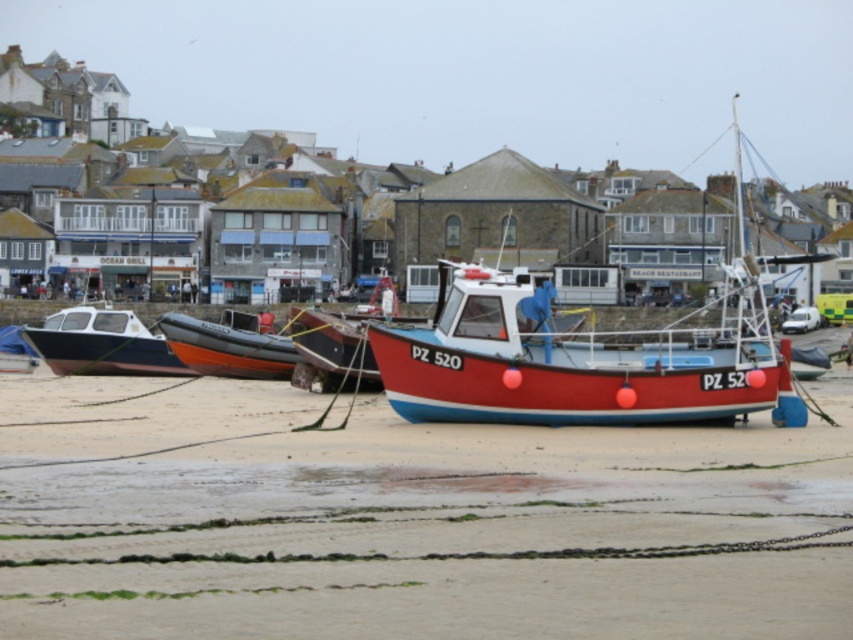
You are standing on the beach and want to walk from the smooth sand at lower center to the brushed metal boat at left. Which direction should you move to reach the boat?

The smooth sand at lower center is shorter than the brushed metal boat at left, so you should move towards the left to reach the boat.

You are a marine biologist assessing boat storage on the beach. You need to determine if the red matte boat at center can be moved without affecting the brushed metal boat at left. Based on their heights, is this possible?

The red matte boat at center is taller than the brushed metal boat at left. Since height differences do not directly impact the ability to move the boats independently, the red matte boat at center can be moved without affecting the brushed metal boat at left.